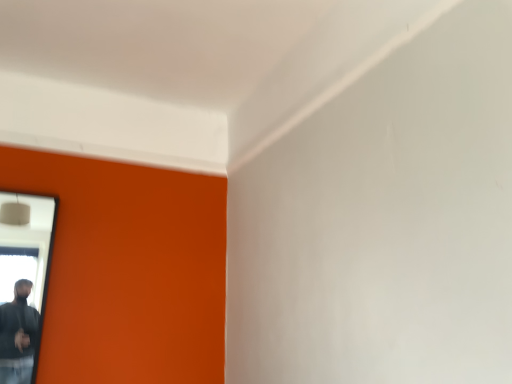
What do you see at coordinates (23, 280) in the screenshot? The height and width of the screenshot is (384, 512). I see `matte black mirror at left` at bounding box center [23, 280].

Image resolution: width=512 pixels, height=384 pixels. Identify the location of matte black mirror at left. (23, 280).

I want to click on matte black mirror at left, so click(23, 280).